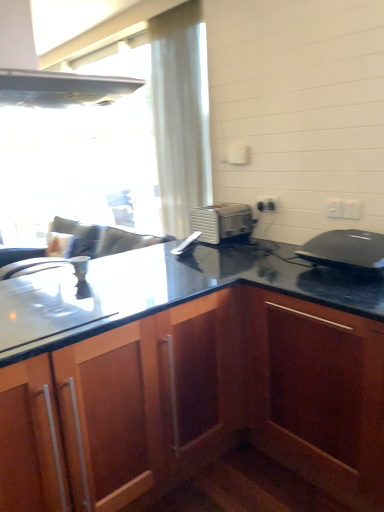
Question: Is white plastic electric outlet at upper right, acting as the 2th electric outlet starting from the left, at the back of black matte laptop at upper right?

Choices:
 (A) no
 (B) yes

Answer: (A)

Question: Does black matte laptop at upper right appear on the right side of white plastic electric outlet at upper right, which ranks as the 2th electric outlet in right-to-left order?

Choices:
 (A) yes
 (B) no

Answer: (A)

Question: From a real-world perspective, is black matte laptop at upper right on top of white plastic electric outlet at upper right, which appears as the 2th electric outlet when viewed from the front?

Choices:
 (A) no
 (B) yes

Answer: (A)

Question: Considering the relative positions of black matte laptop at upper right and white plastic electric outlet at upper right, which appears as the 2th electric outlet when viewed from the front, in the image provided, is black matte laptop at upper right behind white plastic electric outlet at upper right, which appears as the 2th electric outlet when viewed from the front,?

Choices:
 (A) yes
 (B) no

Answer: (B)

Question: From the image's perspective, is black matte laptop at upper right located beneath white plastic electric outlet at upper right, which appears as the 2th electric outlet when viewed from the front?

Choices:
 (A) no
 (B) yes

Answer: (B)

Question: In terms of size, does wooden cabinet at lower left appear bigger or smaller than white plastic electric outlet at upper right, acting as the third electric outlet starting from the back?

Choices:
 (A) big
 (B) small

Answer: (A)

Question: Is wooden cabinet at lower left in front of or behind white plastic electric outlet at upper right, acting as the third electric outlet starting from the back, in the image?

Choices:
 (A) behind
 (B) front

Answer: (B)

Question: Is point (94, 362) closer or farther from the camera than point (355, 208)?

Choices:
 (A) closer
 (B) farther

Answer: (A)

Question: Would you say wooden cabinet at lower left is to the left or to the right of white plastic electric outlet at upper right, which appears as the 3th electric outlet when viewed from the left, in the picture?

Choices:
 (A) left
 (B) right

Answer: (A)

Question: From a real-world perspective, is white plastic electric outlet at upper right, positioned as the first electric outlet in right-to-left order, physically located above or below white plastic electric outlet at upper right, which appears as the 2th electric outlet when viewed from the front?

Choices:
 (A) above
 (B) below

Answer: (A)

Question: Does point tap(357, 209) appear closer or farther from the camera than point tap(329, 212)?

Choices:
 (A) farther
 (B) closer

Answer: (B)

Question: In terms of size, does white plastic electric outlet at upper right, positioned as the first electric outlet in right-to-left order, appear bigger or smaller than white plastic electric outlet at upper right, which appears as the 2th electric outlet when viewed from the front?

Choices:
 (A) small
 (B) big

Answer: (A)

Question: From the image's perspective, relative to white plastic electric outlet at upper right, which appears as the 2th electric outlet when viewed from the front, is white plastic electric outlet at upper right, the 1th electric outlet from the front, above or below?

Choices:
 (A) above
 (B) below

Answer: (B)

Question: Is white plastic electric outlet at upper right, the 1th electric outlet from the front, in front of or behind white plastic electric outlet at upper right, acting as the 3th electric outlet starting from the front, in the image?

Choices:
 (A) front
 (B) behind

Answer: (A)

Question: From the image's perspective, relative to white plastic electric outlet at upper right, the first electric outlet in the back-to-front sequence, is white plastic electric outlet at upper right, the 1th electric outlet from the front, above or below?

Choices:
 (A) below
 (B) above

Answer: (A)